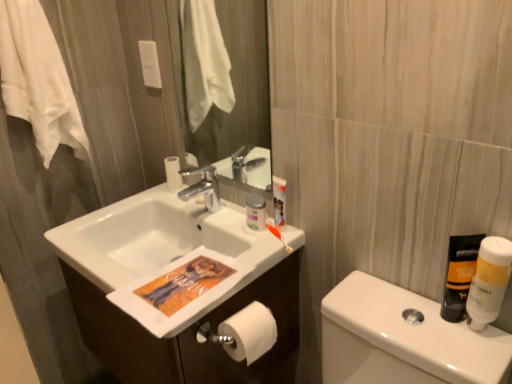
Identify the location of free space to the left of white matte bottle at right, which is counted as the first mouthwash, starting from the right. The height and width of the screenshot is (384, 512). pyautogui.click(x=406, y=318).